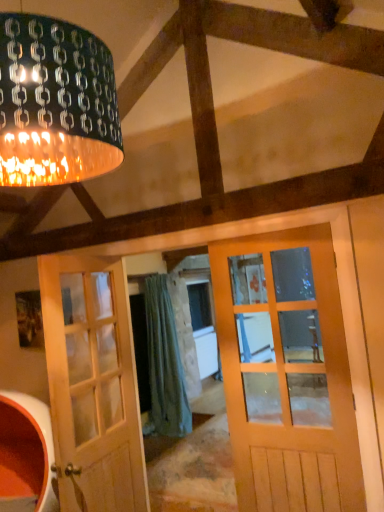
Question: Does matte black lampshade at upper left touch green fabric curtain at center?

Choices:
 (A) no
 (B) yes

Answer: (A)

Question: Is matte black lampshade at upper left to the right of green fabric curtain at center from the viewer's perspective?

Choices:
 (A) yes
 (B) no

Answer: (B)

Question: From a real-world perspective, is matte black lampshade at upper left on green fabric curtain at center?

Choices:
 (A) no
 (B) yes

Answer: (B)

Question: Considering the relative sizes of matte black lampshade at upper left and green fabric curtain at center in the image provided, is matte black lampshade at upper left wider than green fabric curtain at center?

Choices:
 (A) no
 (B) yes

Answer: (B)

Question: From the image's perspective, is matte black lampshade at upper left located above green fabric curtain at center?

Choices:
 (A) no
 (B) yes

Answer: (B)

Question: Is the depth of matte black lampshade at upper left less than that of green fabric curtain at center?

Choices:
 (A) yes
 (B) no

Answer: (A)

Question: From the image's perspective, is green fabric curtain at center located beneath matte black lampshade at upper left?

Choices:
 (A) yes
 (B) no

Answer: (A)

Question: Can you confirm if green fabric curtain at center is taller than matte black lampshade at upper left?

Choices:
 (A) yes
 (B) no

Answer: (A)

Question: Is green fabric curtain at center positioned far away from matte black lampshade at upper left?

Choices:
 (A) yes
 (B) no

Answer: (A)

Question: From the image's perspective, is green fabric curtain at center above matte black lampshade at upper left?

Choices:
 (A) no
 (B) yes

Answer: (A)

Question: Is green fabric curtain at center at the right side of matte black lampshade at upper left?

Choices:
 (A) yes
 (B) no

Answer: (A)

Question: Is green fabric curtain at center bigger than matte black lampshade at upper left?

Choices:
 (A) yes
 (B) no

Answer: (A)

Question: Is matte black lampshade at upper left thinner than white wood door at left?

Choices:
 (A) yes
 (B) no

Answer: (B)